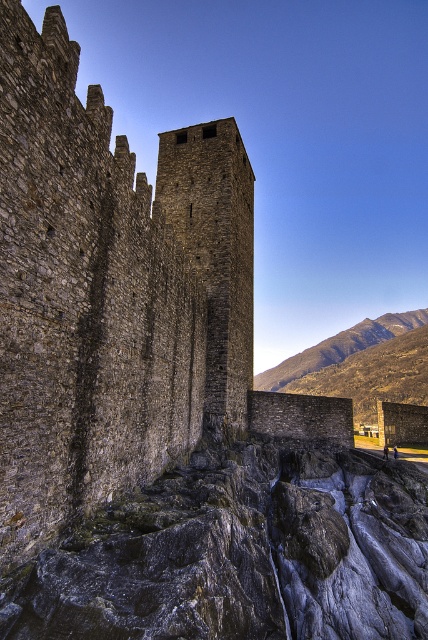
Looking at this image, you are a medieval architect examining the fortress layout. You need to determine which structure is shorter between the gray stone waterfall at lower center and the dark gray stone tower at center. Based on the scene, which one is shorter?

The gray stone waterfall at lower center is shorter than the dark gray stone tower at center.

You are standing at the entrance of the medieval fortress and want to locate the gray stone waterfall at lower center. According to the coordinates provided, where exactly should you look?

The gray stone waterfall at lower center is located at point coordinates of [240,554].

In the scene shown: You are standing at the base of the fortress and see two points marked on the rocky foreground. Which point is closer to you, point (x=380, y=570) or point (x=178, y=196)?

Point (x=380, y=570) is in front of point (x=178, y=196), so it is closer to you.